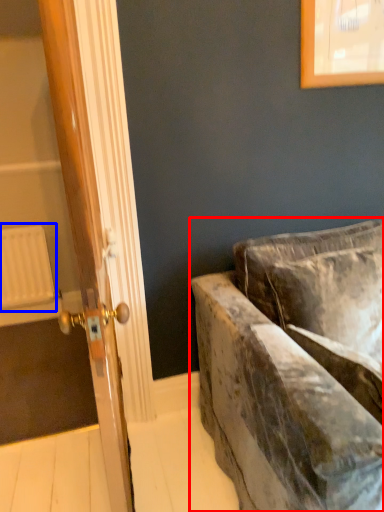
Question: Which object appears closest to the camera in this image, studio couch (highlighted by a red box) or radiator (highlighted by a blue box)?

Choices:
 (A) studio couch
 (B) radiator

Answer: (A)